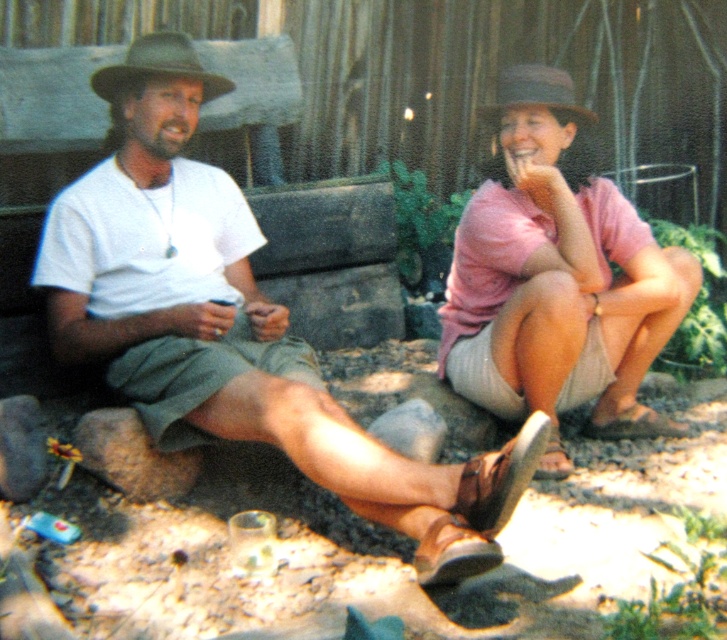
Question: Which point is farther from the camera taking this photo?

Choices:
 (A) (542, 92)
 (B) (188, 44)

Answer: (A)

Question: Which object is closer to the camera taking this photo?

Choices:
 (A) gray felt cowboy hat at upper right
 (B) brown felt cowboy hat at upper left

Answer: (B)

Question: Does matte khaki shorts at center have a larger size compared to pink fabric shirt at upper right?

Choices:
 (A) no
 (B) yes

Answer: (B)

Question: Which of the following is the farthest from the observer?

Choices:
 (A) brown felt cowboy hat at upper left
 (B) pink fabric shirt at upper right

Answer: (B)

Question: Where is brown felt cowboy hat at upper left located in relation to gray felt cowboy hat at upper right in the image?

Choices:
 (A) right
 (B) left

Answer: (B)

Question: Does matte khaki shorts at center appear on the right side of brown felt cowboy hat at upper left?

Choices:
 (A) no
 (B) yes

Answer: (B)